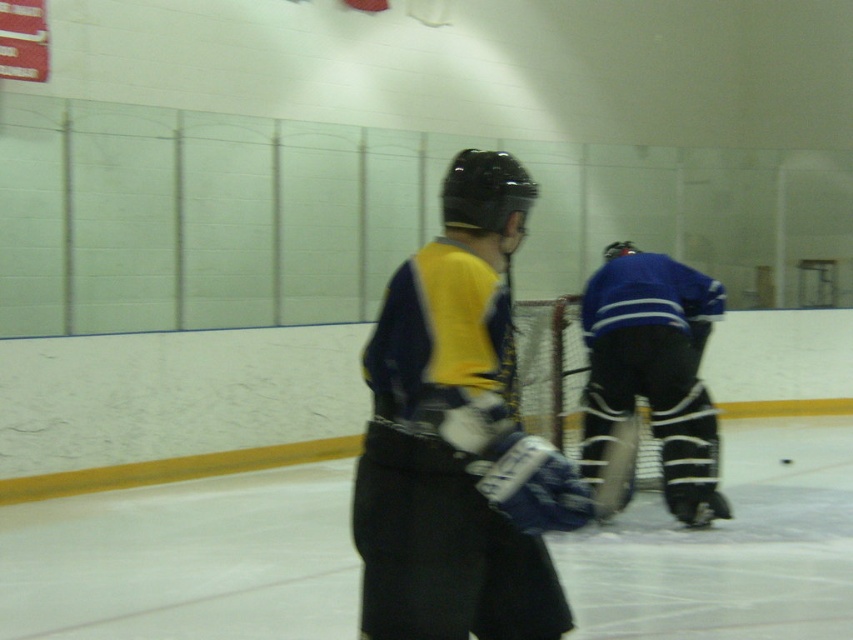
Can you confirm if matte black hockey stick at center is positioned to the left of white padded goalie at center?

Indeed, matte black hockey stick at center is positioned on the left side of white padded goalie at center.

Describe the element at coordinates (457, 436) in the screenshot. I see `matte black hockey stick at center` at that location.

Identify the location of matte black hockey stick at center. This screenshot has height=640, width=853. (457, 436).